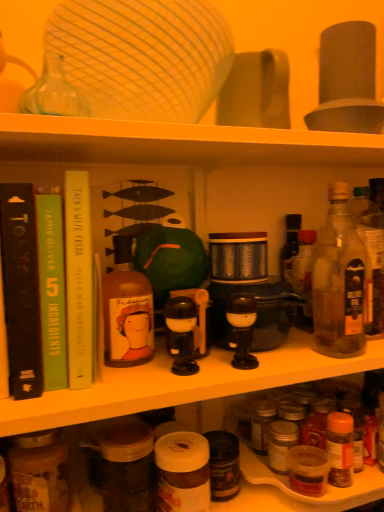
At what (x,y) coordinates should I click in order to perform the action: click on vacant area to the right of matte glass bottle at center-left, which is the 2th bottle from left to right. Please return your answer as a coordinate pair (x, y). Looking at the image, I should click on (262, 360).